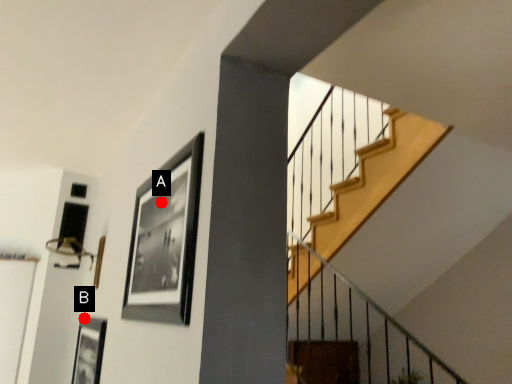
Question: Two points are circled on the image, labeled by A and B beside each circle. Which of the following is the closest to the observer?

Choices:
 (A) A is closer
 (B) B is closer

Answer: (A)